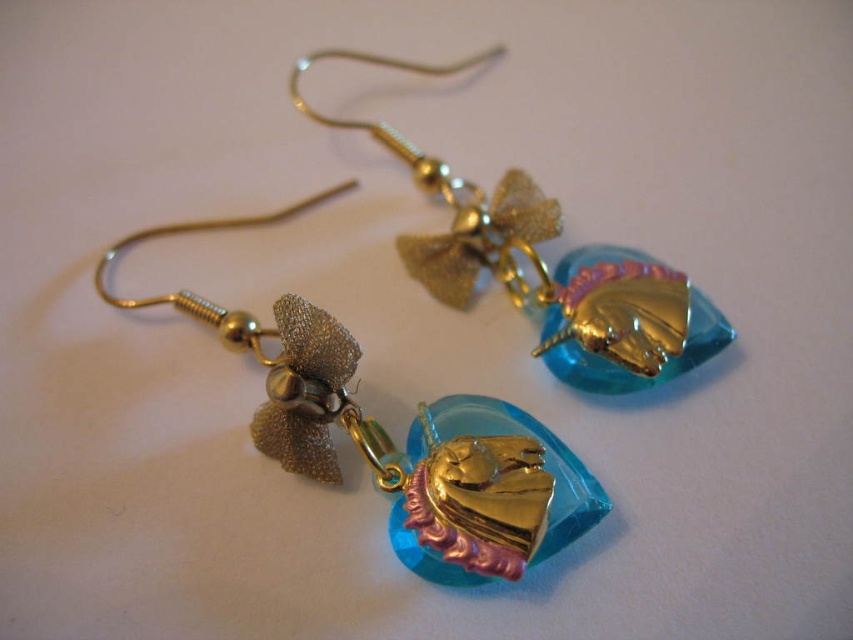
Is translucent blue glass heart at center thinner than translucent blue glass pendant at center?

No.

Who is more forward, (421,564) or (666,273)?

Point (421,564) is in front.

This screenshot has width=853, height=640. Describe the element at coordinates (407, 438) in the screenshot. I see `translucent blue glass heart at center` at that location.

The width and height of the screenshot is (853, 640). What are the coordinates of `translucent blue glass heart at center` in the screenshot? It's located at (407, 438).